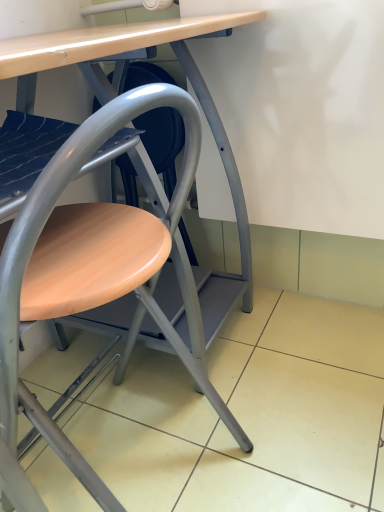
In order to click on wooden seat at center in this screenshot , I will do `click(86, 276)`.

What do you see at coordinates (86, 276) in the screenshot? The height and width of the screenshot is (512, 384). I see `wooden seat at center` at bounding box center [86, 276].

The width and height of the screenshot is (384, 512). I want to click on wooden seat at center, so click(86, 276).